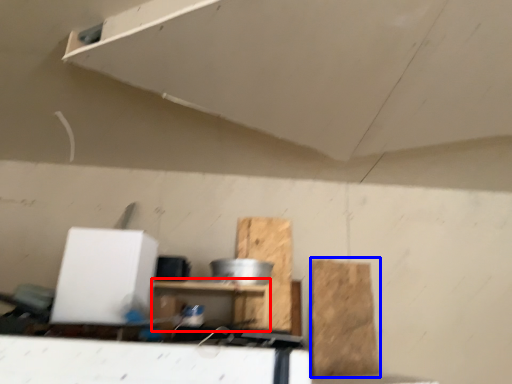
Question: Among these objects, which one is farthest to the camera, furniture (highlighted by a red box) or cardboard (highlighted by a blue box)?

Choices:
 (A) furniture
 (B) cardboard

Answer: (B)